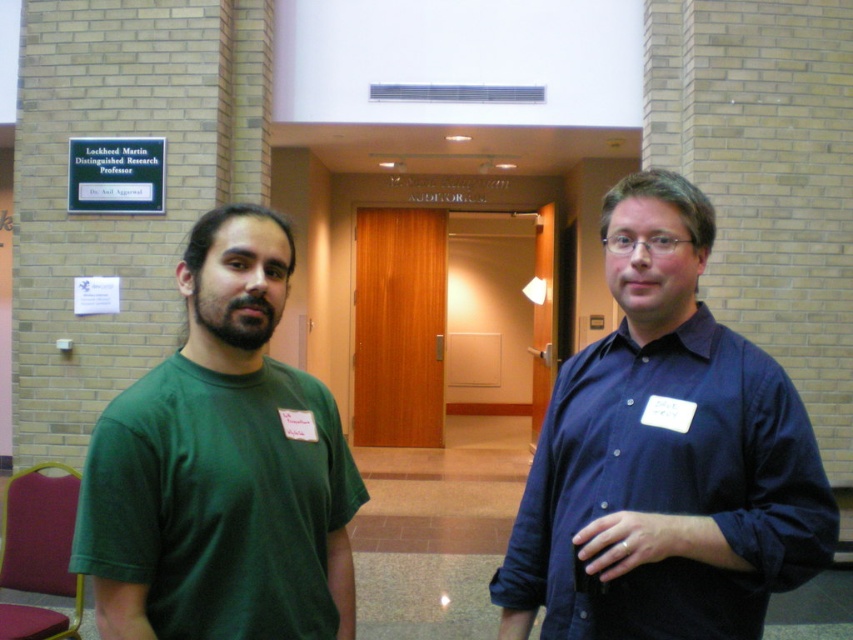
Is the position of green matte t-shirt at left more distant than that of dark blue button-up shirt at right?

No, green matte t-shirt at left is closer to the viewer.

Is point (338, 577) closer to camera compared to point (524, 547)?

That is True.

The height and width of the screenshot is (640, 853). Identify the location of green matte t-shirt at left. (221, 467).